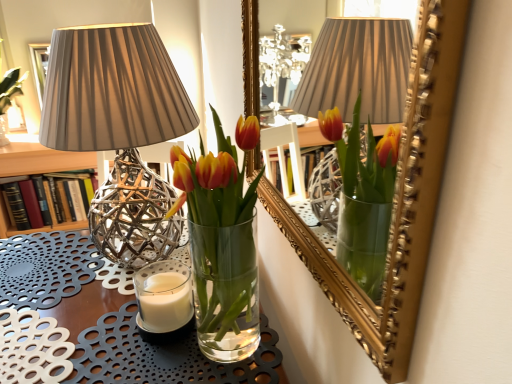
Question: Can you confirm if white wax candle at lower left is positioned to the left of hardcover book at left?

Choices:
 (A) yes
 (B) no

Answer: (B)

Question: Considering the relative positions of white wax candle at lower left and hardcover book at left in the image provided, is white wax candle at lower left behind hardcover book at left?

Choices:
 (A) yes
 (B) no

Answer: (B)

Question: Is white wax candle at lower left positioned with its back to hardcover book at left?

Choices:
 (A) yes
 (B) no

Answer: (B)

Question: Considering the relative sizes of white wax candle at lower left and hardcover book at left in the image provided, is white wax candle at lower left bigger than hardcover book at left?

Choices:
 (A) yes
 (B) no

Answer: (B)

Question: Are white wax candle at lower left and hardcover book at left making contact?

Choices:
 (A) yes
 (B) no

Answer: (B)

Question: Can you confirm if white wax candle at lower left is wider than hardcover book at left?

Choices:
 (A) no
 (B) yes

Answer: (A)

Question: Is white wax candle at lower left inside translucent glass vase at center?

Choices:
 (A) no
 (B) yes

Answer: (A)

Question: Is translucent glass vase at center turned away from white wax candle at lower left?

Choices:
 (A) no
 (B) yes

Answer: (A)

Question: Is translucent glass vase at center with white wax candle at lower left?

Choices:
 (A) yes
 (B) no

Answer: (B)

Question: Is translucent glass vase at center positioned far away from white wax candle at lower left?

Choices:
 (A) yes
 (B) no

Answer: (B)

Question: Does translucent glass vase at center appear on the left side of white wax candle at lower left?

Choices:
 (A) yes
 (B) no

Answer: (B)

Question: From a real-world perspective, is translucent glass vase at center positioned over white wax candle at lower left based on gravity?

Choices:
 (A) yes
 (B) no

Answer: (A)

Question: Can you confirm if clear glass vase at center is thinner than hardcover book at left?

Choices:
 (A) no
 (B) yes

Answer: (A)